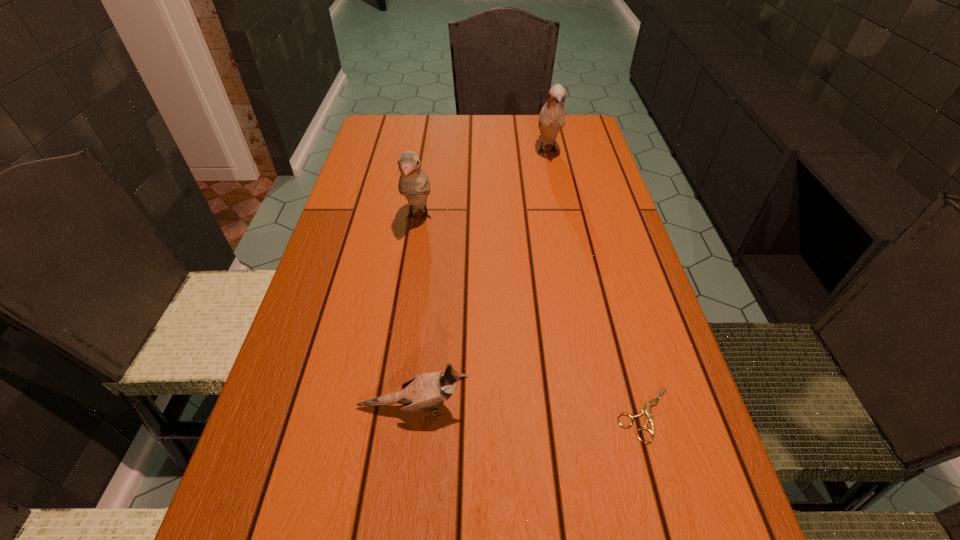
Locate an element on the screen. The height and width of the screenshot is (540, 960). the rightmost bird is located at coordinates (552, 117).

The height and width of the screenshot is (540, 960). Find the location of `the farthest bird`. the farthest bird is located at coordinates (552, 117).

The image size is (960, 540). I want to click on the second farthest bird, so click(x=414, y=184).

Identify the location of the shortest bird. The width and height of the screenshot is (960, 540). (424, 392).

At what (x,y) coordinates should I click in order to perform the action: click on the third tallest object. Please return your answer as a coordinate pair (x, y). This screenshot has width=960, height=540. Looking at the image, I should click on (424, 392).

Where is `the shortest object`? the shortest object is located at coordinates (646, 410).

This screenshot has width=960, height=540. I want to click on vacant area situated 0.210m at the beak of the rightmost bird, so click(561, 214).

The width and height of the screenshot is (960, 540). Find the location of `vacant space located at the face of the third nearest object`. vacant space located at the face of the third nearest object is located at coordinates (408, 286).

Identify the location of free location located at the face of the nearest bird. (636, 407).

Where is `vacant space located 0.300m on the left of the shears`? This screenshot has height=540, width=960. vacant space located 0.300m on the left of the shears is located at coordinates (441, 414).